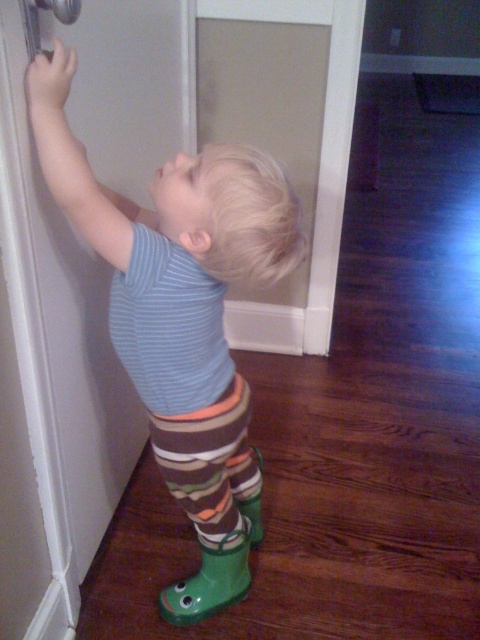
Consider the image. The scene shows a child in a hallway. There is a point marked at coordinates (180, 316). What object is located at that point?

The point at coordinates (180, 316) indicates green rubber boots at lower left.

You are a parent trying to help your child put on their green rubber boots at lower left and green rubber boot at lower right. Which boot should you hand to your child first if you want to put them on in the correct left and right positions?

The green rubber boots at lower left is to the right of green rubber boot at lower right, so you should hand the green rubber boot at lower right first to ensure proper placement.